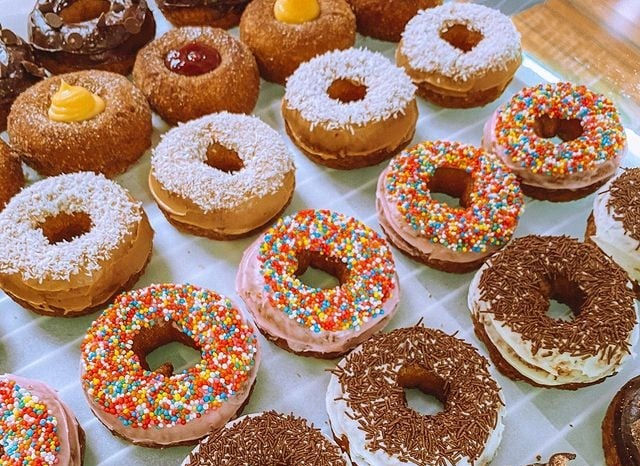
At what (x,y) coordinates should I click in order to perform the action: click on light reflecting off table. Please return your answer as a coordinate pair (x, y). The height and width of the screenshot is (466, 640). Looking at the image, I should click on (624, 14).